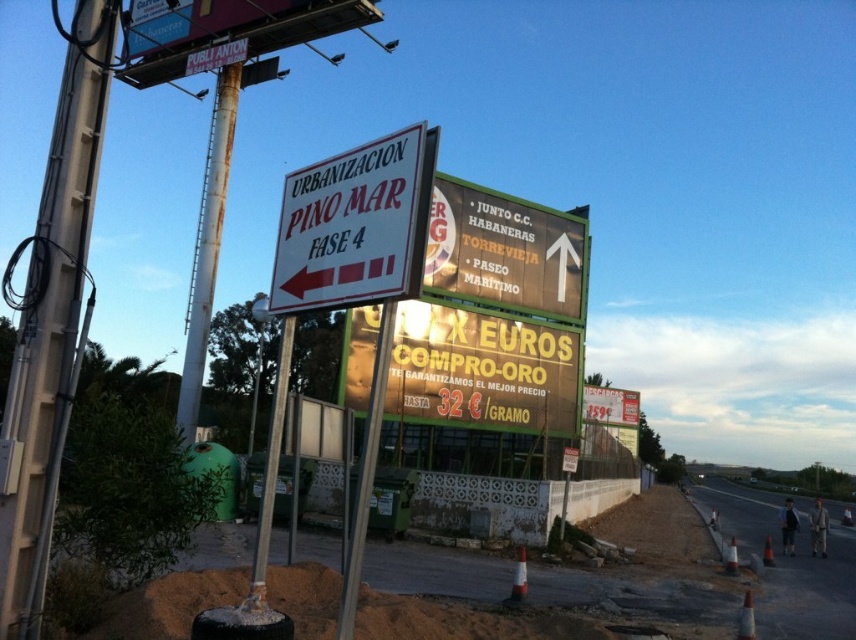
You are driving along this road and see both the white matte sign at left and the green matte sign at upper center. Which one is positioned more to the left side of the road?

The white matte sign at left is positioned more to the left side of the road than the green matte sign at upper center.